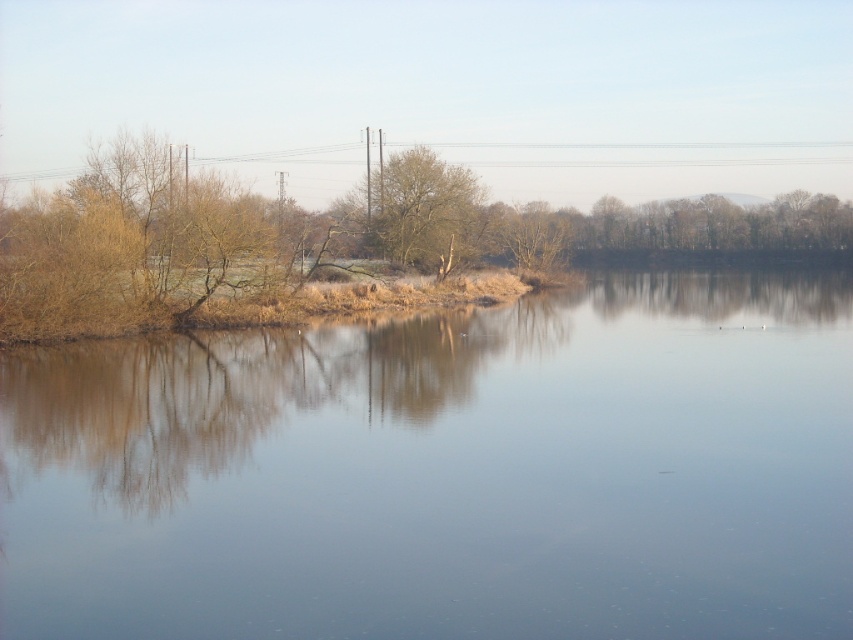
From the picture: You are standing at the edge of the water and want to throw a stone into the smooth water at center. To ensure the stone lands in the water and not on the brown textured tree at center, how should you aim?

The smooth water at center is wider than the brown textured tree at center, so aim towards the center of the water where it is wider than the tree. This ensures the stone will land in the water instead of the tree.